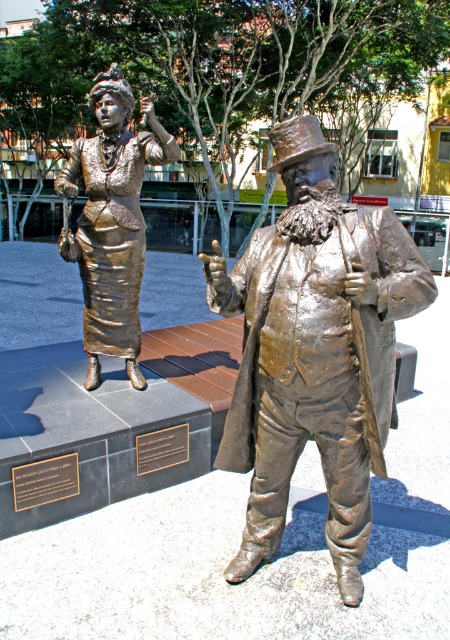
Question: Can you confirm if shiny bronze statue at center is wider than black polished stone plaque at lower left?

Choices:
 (A) no
 (B) yes

Answer: (B)

Question: Is shiny bronze statue at center wider than shiny gold dress at left?

Choices:
 (A) yes
 (B) no

Answer: (A)

Question: Which point appears farthest from the camera in this image?

Choices:
 (A) (55, 497)
 (B) (145, 452)
 (C) (111, 148)
 (D) (246, 538)

Answer: (C)

Question: Which is farther from the shiny bronze statue at center?

Choices:
 (A) black polished metal plaque at center
 (B) black polished stone plaque at lower left

Answer: (B)

Question: Which object is farther from the camera taking this photo?

Choices:
 (A) shiny bronze statue at center
 (B) black polished stone plaque at lower left
 (C) shiny gold dress at left
 (D) black polished metal plaque at center

Answer: (D)

Question: Is black polished stone plaque at lower left positioned behind black polished metal plaque at center?

Choices:
 (A) yes
 (B) no

Answer: (B)